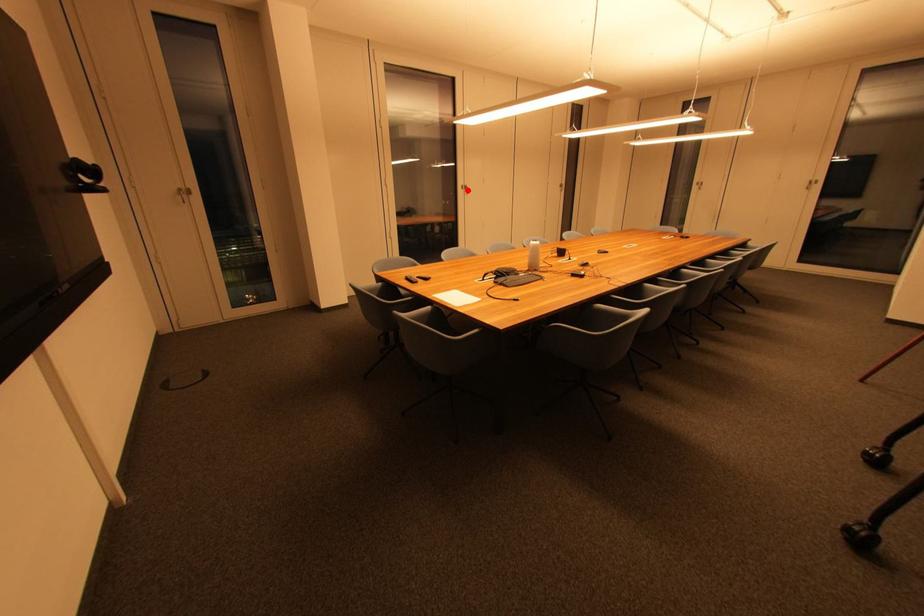
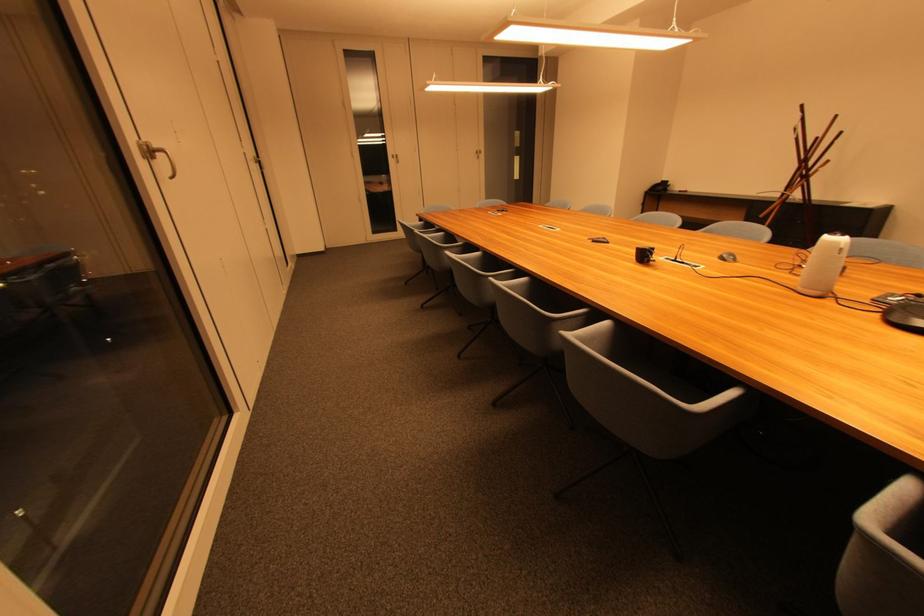
Question: A red point is marked in image1. In image2, is the corresponding 3D point closer to the camera or farther? Reply with the corresponding letter.

Choices:
 (A) The corresponding 3D point is closer.
 (B) The corresponding 3D point is farther.

Answer: (B)